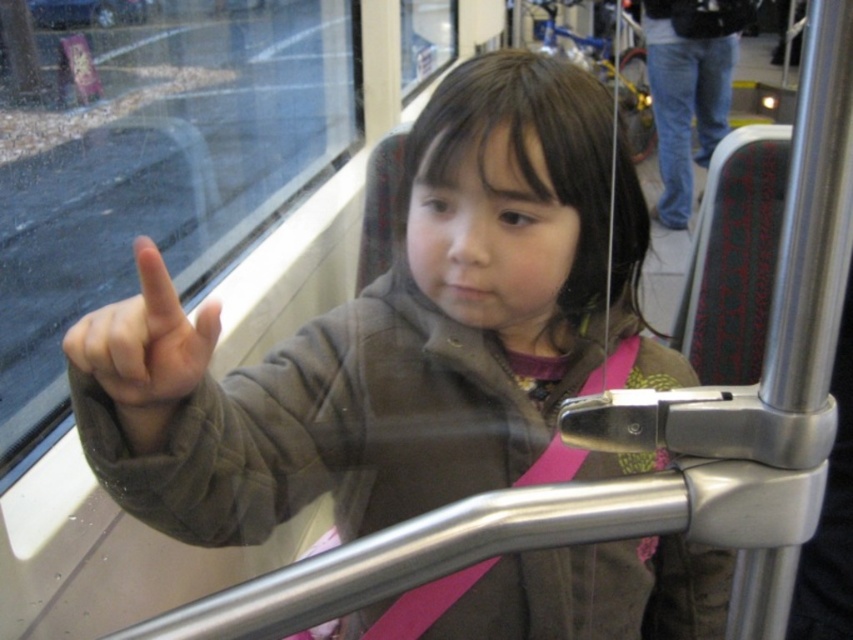
You are a passenger on a bus and see a point outside the window. The point is at coordinates point (642, 225). If your hand is 12 inches long, can you reach it through the window?

The point (642, 225) is 31.52 inches away from the viewer. Since your hand is only 12 inches long, you cannot reach it through the window.

Consider the image. The child is wearing a brown matte jacket at center and jeans at upper right. Which piece of clothing is positioned to the right side?

The jeans at upper right are positioned to the right side of the brown matte jacket at center.

The child is pointing at two points on the window. From the child perspective, which point is closer to them, point (108,481) or point (142,387)?

Point (142,387) is closer to the child because it is less further to the camera than point (108,481).